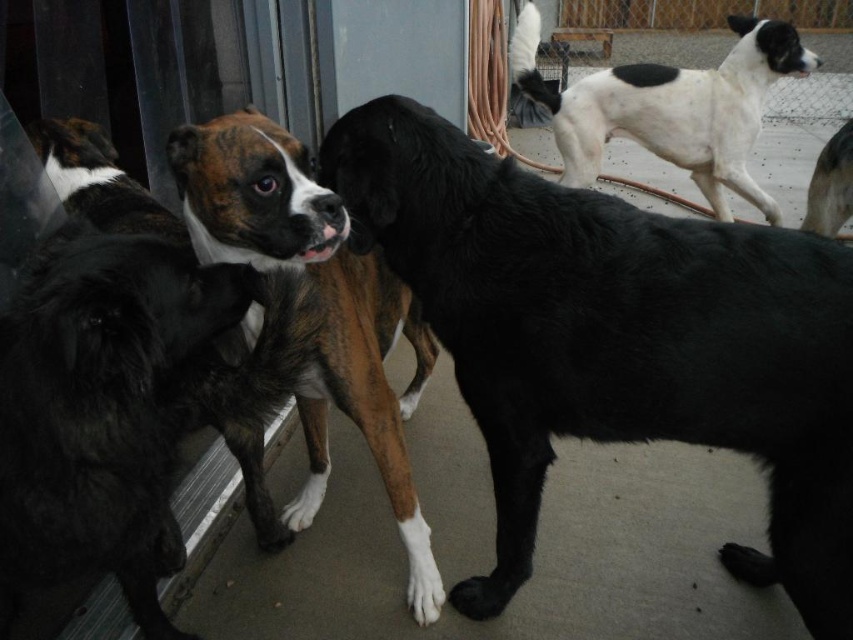
Question: Which point is farther to the camera?

Choices:
 (A) (642, 413)
 (B) (532, 13)
 (C) (380, 401)
 (D) (842, 198)

Answer: (B)

Question: Does brown brindle fur at center appear on the left side of black glossy dog at upper right?

Choices:
 (A) no
 (B) yes

Answer: (B)

Question: Which of the following is the closest to the observer?

Choices:
 (A) white/black fur dog at upper right
 (B) black smooth dog at center
 (C) brown brindle fur at center

Answer: (B)

Question: Observing the image, what is the correct spatial positioning of black smooth dog at center in reference to brown brindle fur at center?

Choices:
 (A) left
 (B) right

Answer: (B)

Question: Based on their relative distances, which object is nearer to the brown brindle fur at center?

Choices:
 (A) black glossy dog at upper right
 (B) white/black fur dog at upper right
 (C) black smooth dog at center

Answer: (C)

Question: Is white/black fur dog at upper right bigger than black glossy dog at upper right?

Choices:
 (A) no
 (B) yes

Answer: (B)